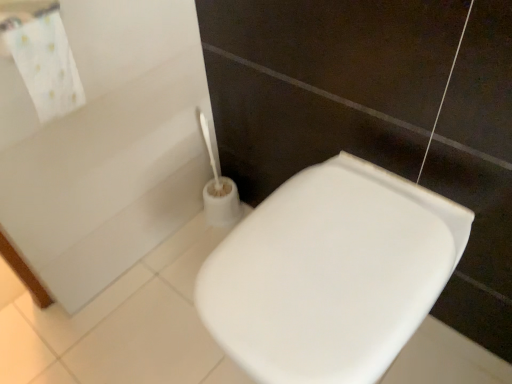
Question: Is white glossy toilet seat at lower right shorter than white fabric towel at upper left?

Choices:
 (A) yes
 (B) no

Answer: (B)

Question: Is white fabric towel at upper left at the back of white glossy toilet seat at lower right?

Choices:
 (A) yes
 (B) no

Answer: (B)

Question: Is white glossy toilet seat at lower right not within white fabric towel at upper left?

Choices:
 (A) no
 (B) yes

Answer: (B)

Question: Considering the relative sizes of white glossy toilet seat at lower right and white fabric towel at upper left in the image provided, is white glossy toilet seat at lower right smaller than white fabric towel at upper left?

Choices:
 (A) no
 (B) yes

Answer: (A)

Question: From the image's perspective, would you say white glossy toilet seat at lower right is positioned over white fabric towel at upper left?

Choices:
 (A) no
 (B) yes

Answer: (A)

Question: Is white glossy toilet seat at lower right taller than white fabric towel at upper left?

Choices:
 (A) yes
 (B) no

Answer: (A)

Question: Can you see white fabric towel at upper left touching white glossy toilet seat at lower right?

Choices:
 (A) no
 (B) yes

Answer: (A)

Question: Does white fabric towel at upper left have a lesser width compared to white glossy toilet seat at lower right?

Choices:
 (A) yes
 (B) no

Answer: (A)

Question: Considering the relative positions of white fabric towel at upper left and white glossy toilet seat at lower right in the image provided, is white fabric towel at upper left to the left of white glossy toilet seat at lower right from the viewer's perspective?

Choices:
 (A) no
 (B) yes

Answer: (B)

Question: From a real-world perspective, is white fabric towel at upper left physically above white glossy toilet seat at lower right?

Choices:
 (A) yes
 (B) no

Answer: (A)

Question: Is white fabric towel at upper left oriented towards white glossy toilet seat at lower right?

Choices:
 (A) no
 (B) yes

Answer: (A)

Question: Can you confirm if white fabric towel at upper left is bigger than white glossy toilet seat at lower right?

Choices:
 (A) no
 (B) yes

Answer: (A)

Question: From a real-world perspective, relative to white glossy toilet seat at lower right, is white fabric towel at upper left vertically above or below?

Choices:
 (A) above
 (B) below

Answer: (A)